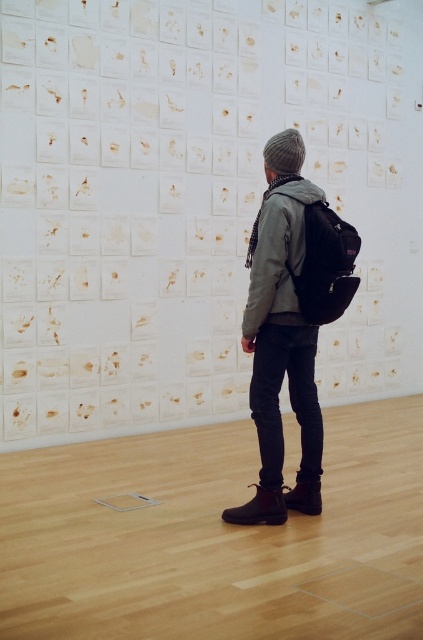
You are a photographer trying to capture the arrangement of the papers on the wall. You notice the matte gray jacket at center and the matte black backpack at center. Which object is positioned to the right side of the other?

The matte gray jacket at center is to the left of the matte black backpack at center, so the matte black backpack at center is positioned to the right side of the matte gray jacket at center.

You are standing in the room and want to touch both points on the wall. Which point should you reach for first, the point at coordinate [235,381] or the point at coordinate [293,182]?

You should reach for point [235,381] first because it is closer to you than point [293,182], which is further away.

You are trying to decide whether to place a new object between the matte gray jacket at center and the matte black backpack at center. Given their sizes, which one should you place the new object closer to?

The matte gray jacket at center is larger than the matte black backpack at center, so you should place the new object closer to the matte black backpack at center to maintain balance.